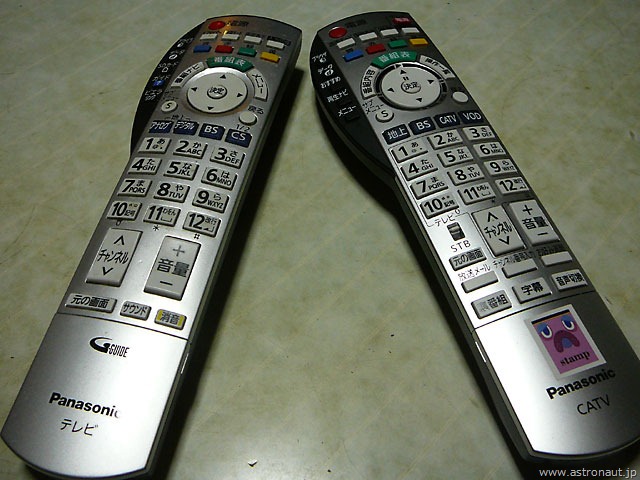
Where is `remotes`? This screenshot has width=640, height=480. remotes is located at coordinates (179, 186), (482, 208).